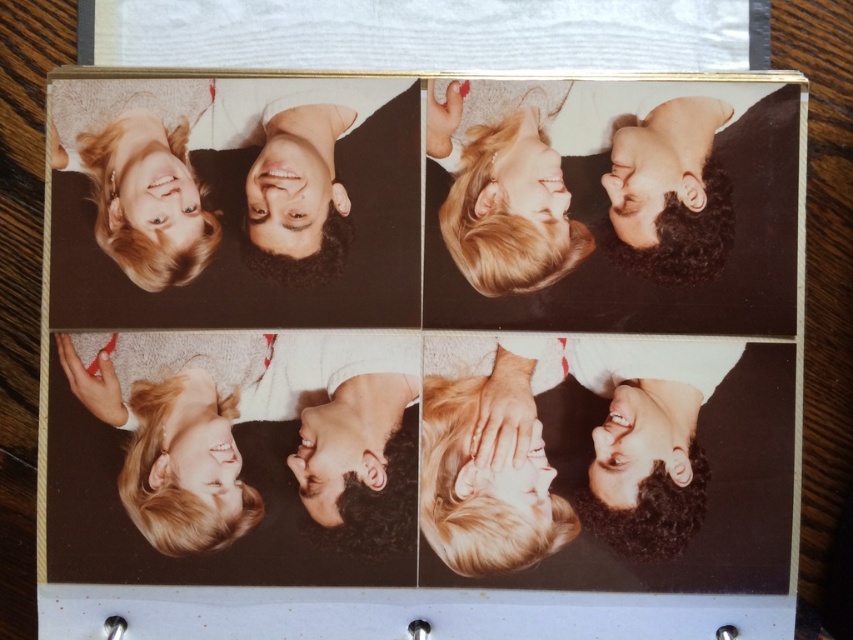
You are a photographer standing in front of the image. You see the blonde hair at upper center. Can you estimate how far it is from you?

The blonde hair at upper center is 67.46 centimeters away from the viewer.

You are standing at the point labeled as point (624, 497) in the image. If you want to take a photo of the camera that took the top left photo, will you be able to see the camera in your view?

The point (624, 497) and the camera are 26.78 inches apart. Since you are at the point, you can see the camera within your line of sight as it is not obstructed by any objects mentioned in the scene description. Therefore, yes, you can see the camera in your view.

Based on the coordinates provided, which part of the face is located at point (292, 166) in the upper left photo?

The smooth skin face at upper left is represented by point (292, 166).